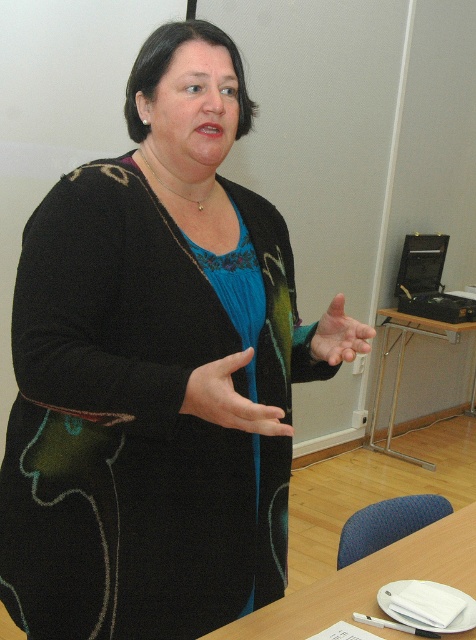
Question: Can you confirm if matte black sweater at center is positioned to the left of wooden table at lower right?

Choices:
 (A) no
 (B) yes

Answer: (B)

Question: Which point is farther to the camera?

Choices:
 (A) matte black sweater at center
 (B) matte black hand at center
 (C) transparent skin hand at center

Answer: (A)

Question: Which of these objects is positioned closest to the matte black hand at center?

Choices:
 (A) wooden table at lower right
 (B) transparent skin hand at center

Answer: (B)

Question: Considering the relative positions of matte black hand at center and wooden table at center in the image provided, where is matte black hand at center located with respect to wooden table at center?

Choices:
 (A) left
 (B) right

Answer: (A)

Question: Which point is closer to the camera?

Choices:
 (A) matte black hand at center
 (B) transparent skin hand at center
 (C) matte black sweater at center

Answer: (A)

Question: Can you confirm if matte black sweater at center is smaller than matte black hand at center?

Choices:
 (A) no
 (B) yes

Answer: (A)